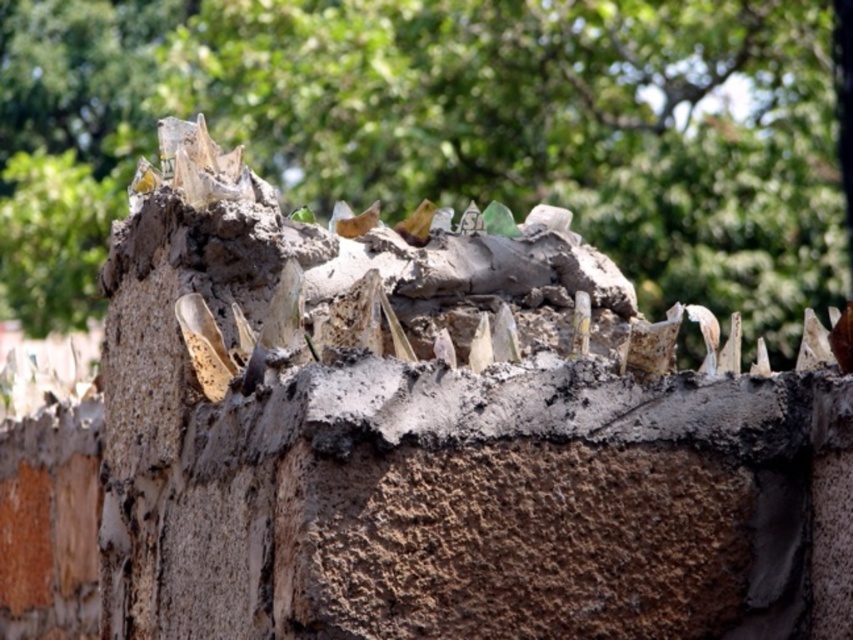
Does brown rough stone at upper center come behind green leafy tree at upper center?

No, it is not.

What do you see at coordinates (439, 440) in the screenshot?
I see `brown rough stone at upper center` at bounding box center [439, 440].

Is point (143, 385) farther from camera compared to point (824, 104)?

No, (143, 385) is closer to viewer.

This screenshot has width=853, height=640. What are the coordinates of `brown rough stone at upper center` in the screenshot? It's located at coord(439,440).